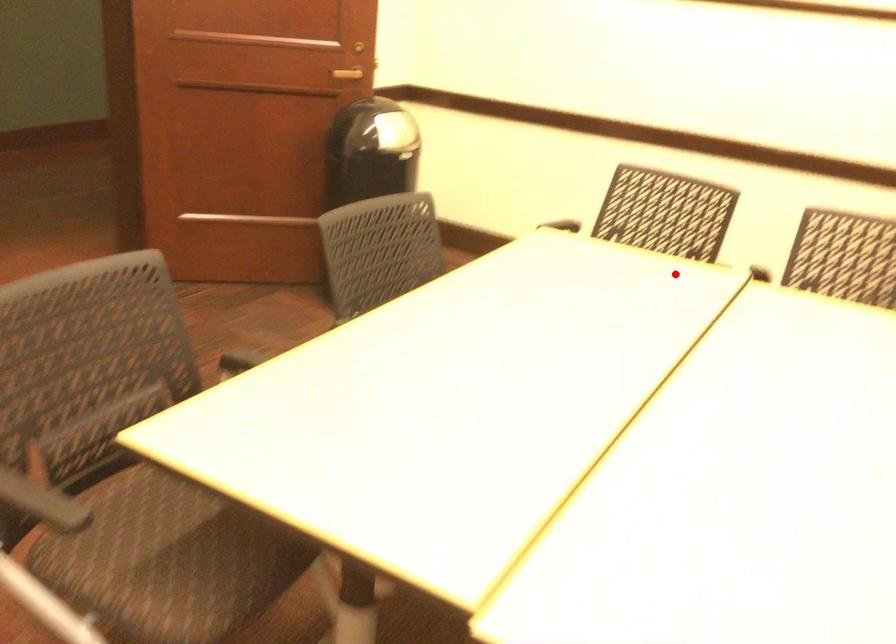
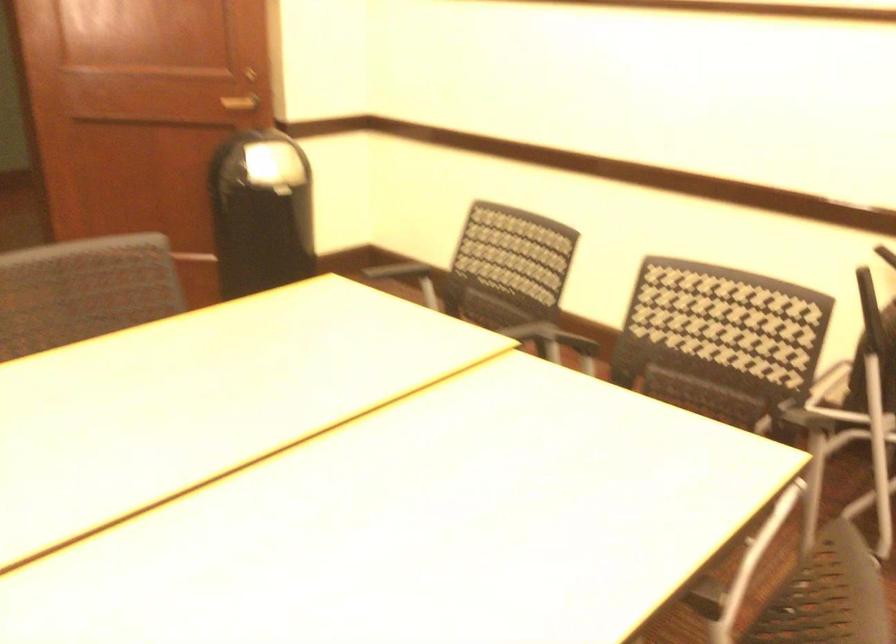
In the second image, find the point that corresponds to the highlighted location in the first image.

(446, 332)